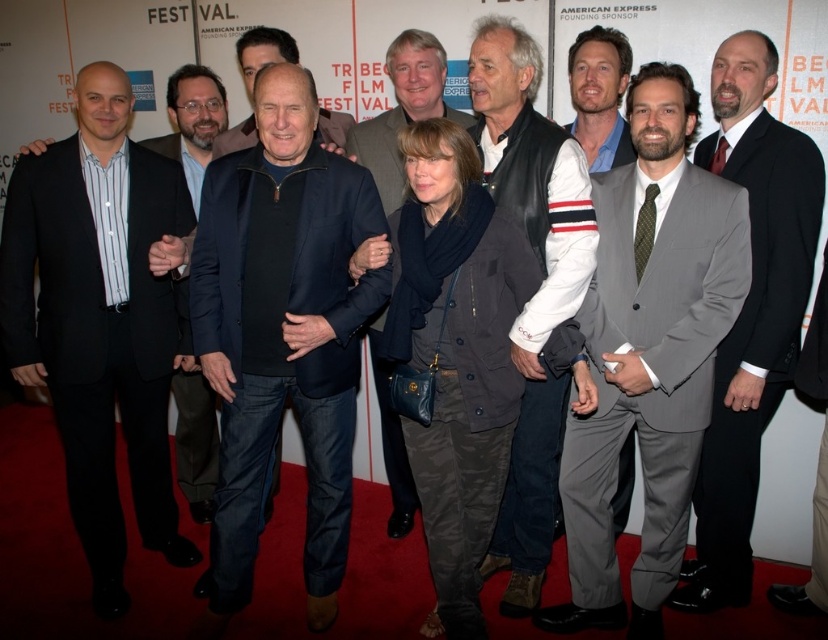
Is light blue shirt at center closer to camera compared to dark blue sweater at center?

No, light blue shirt at center is behind dark blue sweater at center.

Which is below, light blue shirt at center or dark blue sweater at center?

dark blue sweater at center is lower down.

Image resolution: width=828 pixels, height=640 pixels. What do you see at coordinates (599, 97) in the screenshot? I see `light blue shirt at center` at bounding box center [599, 97].

This screenshot has width=828, height=640. In order to click on light blue shirt at center in this screenshot , I will do `click(599, 97)`.

Can you confirm if black matte suit at left is shorter than dark blue sweater at center?

In fact, black matte suit at left may be taller than dark blue sweater at center.

Locate an element on the screen. This screenshot has height=640, width=828. black matte suit at left is located at coordinates (99, 337).

The width and height of the screenshot is (828, 640). I want to click on black matte suit at left, so click(99, 337).

Does gray pinstripe suit at center have a lesser height compared to gray suit at right?

Yes, gray pinstripe suit at center is shorter than gray suit at right.

Is gray pinstripe suit at center taller than gray suit at right?

No, gray pinstripe suit at center is not taller than gray suit at right.

Image resolution: width=828 pixels, height=640 pixels. Describe the element at coordinates (648, 353) in the screenshot. I see `gray pinstripe suit at center` at that location.

Where is `gray pinstripe suit at center`? Image resolution: width=828 pixels, height=640 pixels. gray pinstripe suit at center is located at coordinates (648, 353).